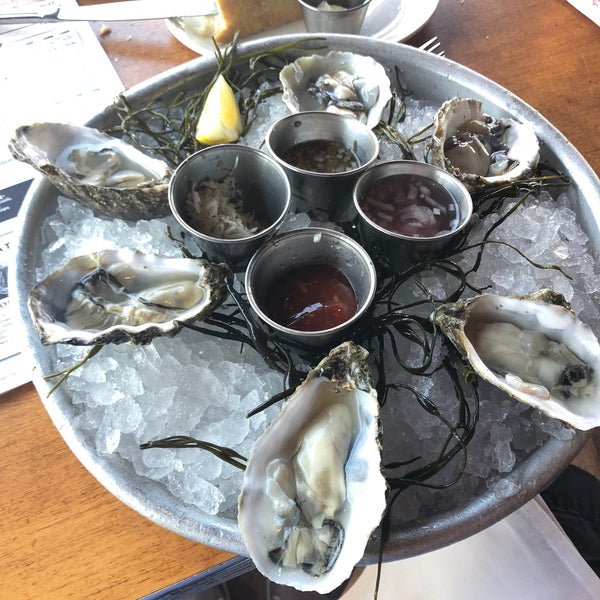
Find the location of `fork`. fork is located at coordinates tap(431, 46).